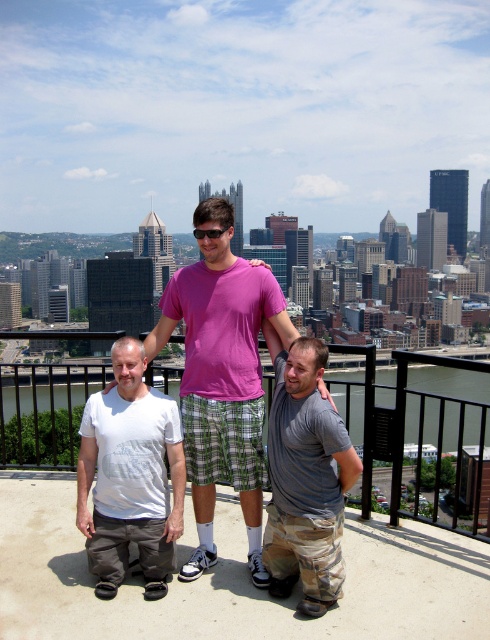
Does gray cotton t-shirt at center appear on the left side of black plastic goggles at center?

In fact, gray cotton t-shirt at center is to the right of black plastic goggles at center.

Between gray cotton t-shirt at center and black plastic goggles at center, which one is positioned lower?

gray cotton t-shirt at center

Locate an element on the screen. The height and width of the screenshot is (640, 490). gray cotton t-shirt at center is located at coordinates (304, 477).

Where is `gray cotton t-shirt at center`? This screenshot has height=640, width=490. gray cotton t-shirt at center is located at coordinates (304, 477).

Can you confirm if white cotton t-shirt at lower left is wider than gray cotton t-shirt at center?

Yes, white cotton t-shirt at lower left is wider than gray cotton t-shirt at center.

Who is more forward, [141,560] or [302,608]?

Positioned in front is point [302,608].

Locate an element on the screen. white cotton t-shirt at lower left is located at coordinates (129, 476).

Does pink cotton t-shirt at center appear under white cotton t-shirt at lower left?

Incorrect, pink cotton t-shirt at center is not positioned below white cotton t-shirt at lower left.

Who is more distant from viewer, (x=191, y=566) or (x=92, y=461)?

The point (x=92, y=461) is behind.

At what (x,y) coordinates should I click in order to perform the action: click on pink cotton t-shirt at center. Please return your answer as a coordinate pair (x, y). Looking at the image, I should click on (221, 385).